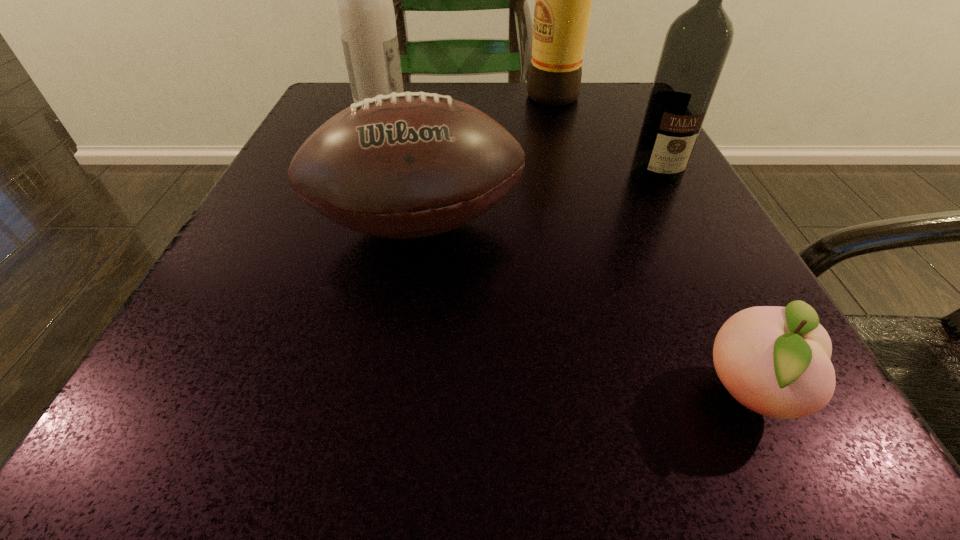
Locate an element on the screen. Image resolution: width=960 pixels, height=540 pixels. free space between the leftmost alcohol and the rightmost alcohol is located at coordinates (518, 141).

Find the location of a particular element. vacant space that's between the nearest object and the football (American) is located at coordinates (583, 310).

Where is `blank region between the peach and the second alcohol from right to left`? The image size is (960, 540). blank region between the peach and the second alcohol from right to left is located at coordinates (651, 245).

At what (x,y) coordinates should I click in order to perform the action: click on empty location between the third object from left to right and the peach. Please return your answer as a coordinate pair (x, y). This screenshot has width=960, height=540. Looking at the image, I should click on (651, 245).

Choose which object is the third nearest neighbor to the second shortest object. Please provide its 2D coordinates. Your answer should be formatted as a tuple, i.e. [(x, y)], where the tuple contains the x and y coordinates of a point satisfying the conditions above.

[(364, 7)]

Select which object is the fourth closest to the football (American). Please provide its 2D coordinates. Your answer should be formatted as a tuple, i.e. [(x, y)], where the tuple contains the x and y coordinates of a point satisfying the conditions above.

[(563, 0)]

Locate which alcohol is the second closest to the leftmost alcohol. Please provide its 2D coordinates. Your answer should be formatted as a tuple, i.e. [(x, y)], where the tuple contains the x and y coordinates of a point satisfying the conditions above.

[(697, 43)]

Locate which alcohol is the closest to the leftmost alcohol. Please provide its 2D coordinates. Your answer should be formatted as a tuple, i.e. [(x, y)], where the tuple contains the x and y coordinates of a point satisfying the conditions above.

[(563, 0)]

Identify the location of free space that satisfies the following two spatial constraints: 1. on the label of the football (American); 2. on the right side of the leftmost alcohol. This screenshot has height=540, width=960. (337, 227).

I want to click on free location that satisfies the following two spatial constraints: 1. on the label of the leftmost alcohol; 2. on the back side of the football (American), so click(x=337, y=227).